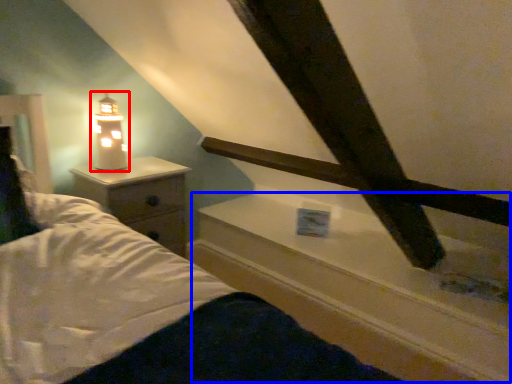
Question: Which point is further to the camera, lamp (highlighted by a red box) or window sill (highlighted by a blue box)?

Choices:
 (A) lamp
 (B) window sill

Answer: (A)